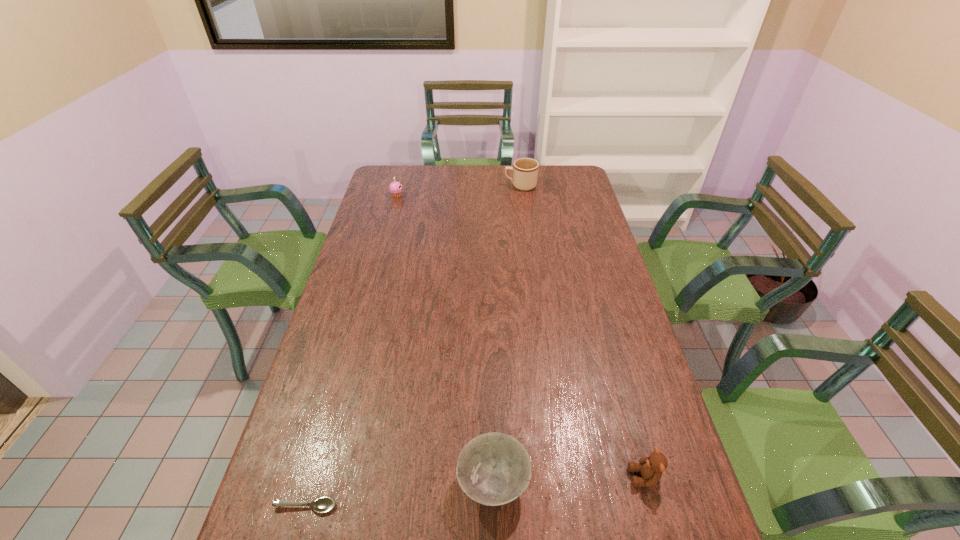
Identify the location of blank space at the right edge of the desktop. (660, 483).

At what (x,y) coordinates should I click in order to perform the action: click on free area in between the cupcake and the shortest object. Please return your answer as a coordinate pair (x, y). This screenshot has width=960, height=540. Looking at the image, I should click on (351, 351).

This screenshot has height=540, width=960. I want to click on free space that is in between the shortest object and the bowl, so click(399, 495).

Identify the location of vacant area that lies between the rightmost object and the bowl. The image size is (960, 540). (569, 480).

In order to click on free space that is in between the rightmost object and the cupcake in this screenshot , I will do `click(520, 336)`.

Where is `free space between the bowl and the mug`? This screenshot has height=540, width=960. free space between the bowl and the mug is located at coordinates (507, 335).

In order to click on vacant area that lies between the soupspoon and the bowl in this screenshot , I will do `click(399, 495)`.

You are a GUI agent. You are given a task and a screenshot of the screen. Output one action in this format:
    pyautogui.click(x=<x>, y=<y>)
    Task: Click on the vacant space that is in between the mug and the cupcake
    This screenshot has width=960, height=540.
    Given the screenshot: What is the action you would take?
    pyautogui.click(x=459, y=191)

The width and height of the screenshot is (960, 540). I want to click on vacant area between the mug and the teddy bear, so click(583, 332).

The image size is (960, 540). I want to click on free space between the bowl and the mug, so click(x=507, y=335).